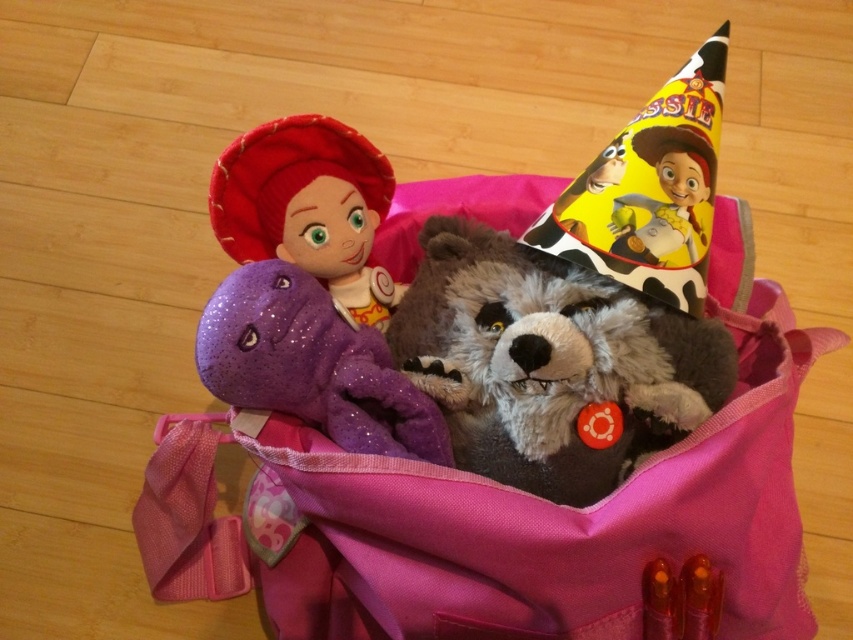
Who is positioned more to the right, fluffy brown stuffed bear at center or matte fabric doll at upper left?

fluffy brown stuffed bear at center is more to the right.

Can you confirm if fluffy brown stuffed bear at center is taller than matte fabric doll at upper left?

Yes.

Identify the location of fluffy brown stuffed bear at center. This screenshot has height=640, width=853. (550, 362).

Is sparkly purple dinosaur at center above matte fabric doll at upper left?

No.

Who is positioned more to the left, sparkly purple dinosaur at center or matte fabric doll at upper left?

matte fabric doll at upper left is more to the left.

Locate an element on the screen. The height and width of the screenshot is (640, 853). sparkly purple dinosaur at center is located at coordinates (312, 364).

Find the location of `sparkly purple dinosaur at center`. sparkly purple dinosaur at center is located at coordinates (312, 364).

Between fluffy brown stuffed bear at center and sparkly purple dinosaur at center, which one is positioned lower?

sparkly purple dinosaur at center

Who is positioned more to the left, fluffy brown stuffed bear at center or sparkly purple dinosaur at center?

sparkly purple dinosaur at center is more to the left.

Does point (732, 365) lie behind point (268, 401)?

Yes, it is behind point (268, 401).

You are a GUI agent. You are given a task and a screenshot of the screen. Output one action in this format:
    pyautogui.click(x=<x>, y=<y>)
    Task: Click on the fluffy brown stuffed bear at center
    
    Given the screenshot: What is the action you would take?
    pyautogui.click(x=550, y=362)